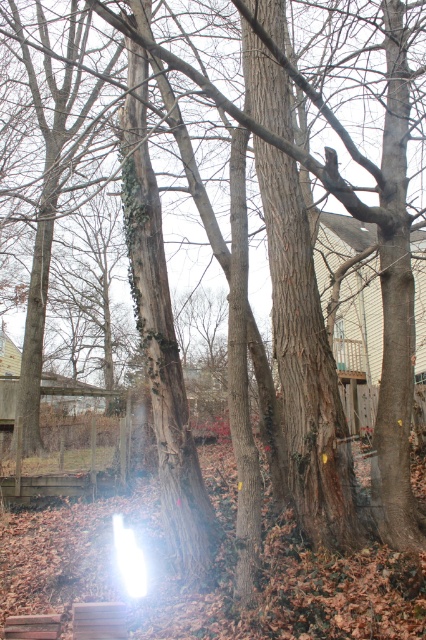
You are standing in the backyard and want to sit down on either the brown wooden bench at lower left or the brown wooden plank at lower left. Which object is closer to you?

The brown wooden bench at lower left is closer to you because it is further to the viewer than the brown wooden plank at lower left.